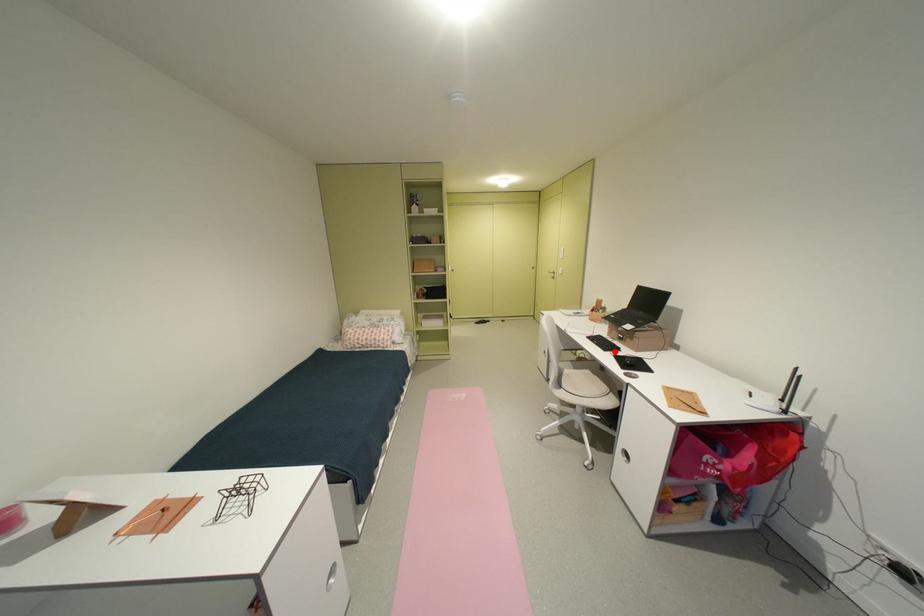
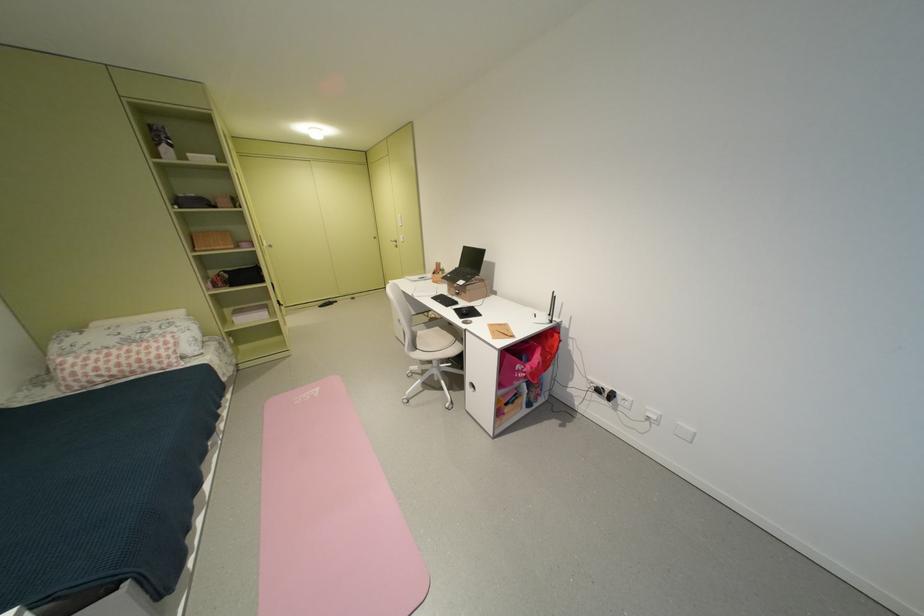
Question: I am providing you with two images of the same scene from different viewpoints. Image1 has a red point marked. In image2, the corresponding 3D location appears at what relative position? Reply with the corresponding letter.

Choices:
 (A) Closer
 (B) Farther

Answer: (B)